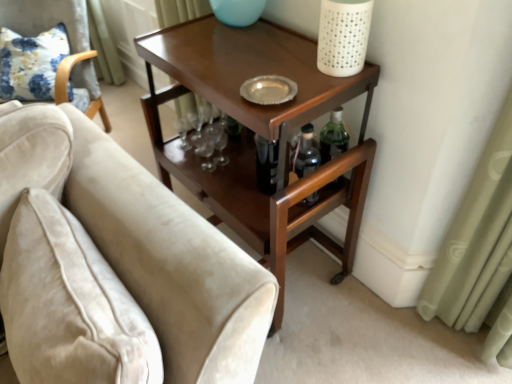
Question: Is velvet beige armchair at left turned away from shiny brown wood side table at center?

Choices:
 (A) no
 (B) yes

Answer: (A)

Question: Can you confirm if velvet beige armchair at left is bigger than shiny brown wood side table at center?

Choices:
 (A) yes
 (B) no

Answer: (A)

Question: Can you confirm if velvet beige armchair at left is thinner than shiny brown wood side table at center?

Choices:
 (A) no
 (B) yes

Answer: (A)

Question: Could you tell me if velvet beige armchair at left is facing shiny brown wood side table at center?

Choices:
 (A) yes
 (B) no

Answer: (B)

Question: Is velvet beige armchair at left closer to the viewer compared to shiny brown wood side table at center?

Choices:
 (A) yes
 (B) no

Answer: (B)

Question: Is velvet beige couch at lower left in front of or behind velvet beige armchair at left in the image?

Choices:
 (A) behind
 (B) front

Answer: (B)

Question: Does point (138, 173) appear closer or farther from the camera than point (90, 61)?

Choices:
 (A) closer
 (B) farther

Answer: (A)

Question: From a real-world perspective, relative to velvet beige armchair at left, is velvet beige couch at lower left vertically above or below?

Choices:
 (A) below
 (B) above

Answer: (B)

Question: Is velvet beige couch at lower left taller or shorter than velvet beige armchair at left?

Choices:
 (A) short
 (B) tall

Answer: (A)

Question: Relative to velvet beige couch at lower left, is shiny brown wood side table at center in front or behind?

Choices:
 (A) behind
 (B) front

Answer: (A)

Question: In terms of height, does shiny brown wood side table at center look taller or shorter compared to velvet beige couch at lower left?

Choices:
 (A) tall
 (B) short

Answer: (A)

Question: From a real-world perspective, is shiny brown wood side table at center physically located above or below velvet beige couch at lower left?

Choices:
 (A) below
 (B) above

Answer: (A)

Question: Does point (331, 243) appear closer or farther from the camera than point (159, 266)?

Choices:
 (A) farther
 (B) closer

Answer: (A)

Question: Considering the positions of shiny brown wood side table at center and velvet beige armchair at left in the image, is shiny brown wood side table at center wider or thinner than velvet beige armchair at left?

Choices:
 (A) thin
 (B) wide

Answer: (A)

Question: In terms of height, does shiny brown wood side table at center look taller or shorter compared to velvet beige armchair at left?

Choices:
 (A) short
 (B) tall

Answer: (A)